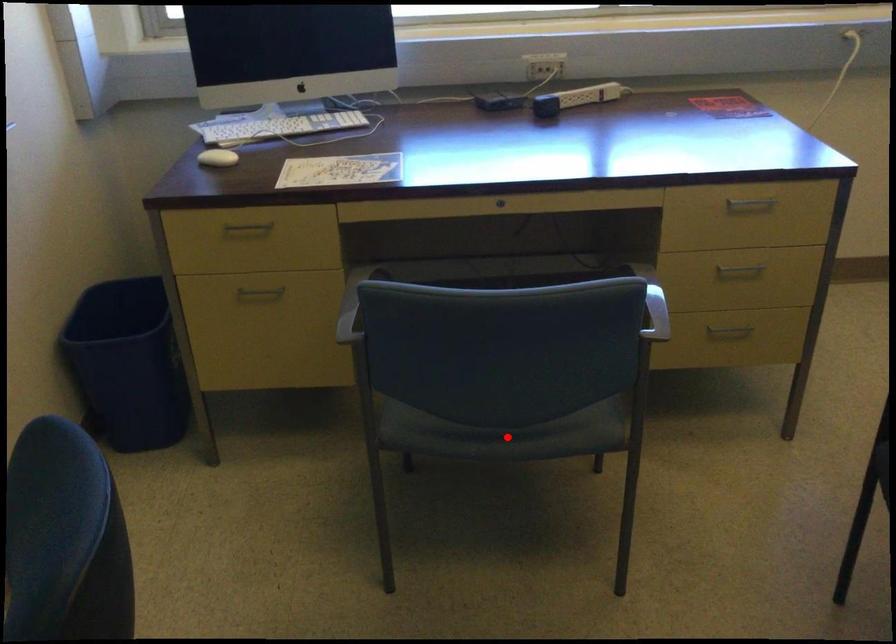
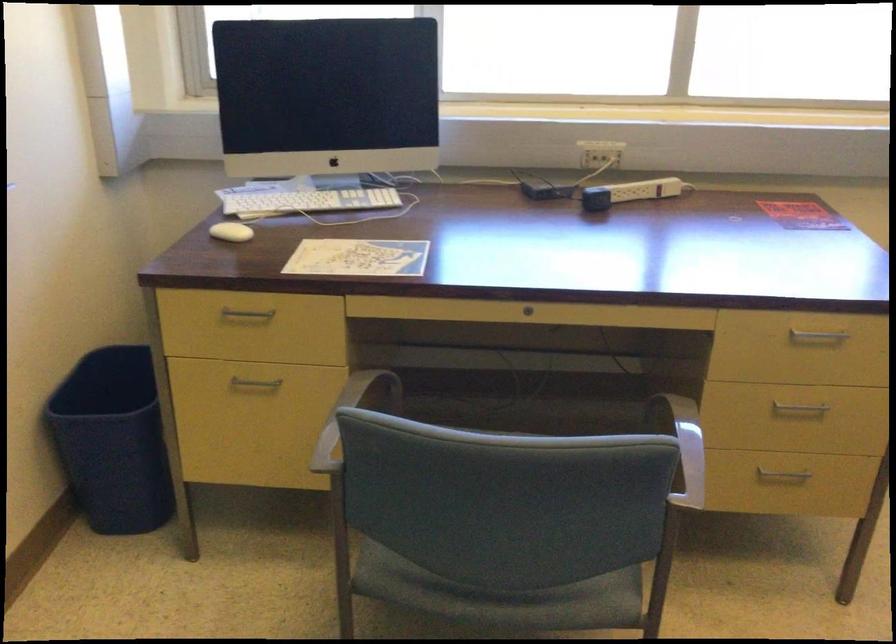
Question: I am providing you with two images of the same scene from different viewpoints. Given a red point in image1, look at the same physical point in image2. Is it:

Choices:
 (A) Closer to the viewpoint
 (B) Farther from the viewpoint

Answer: (A)